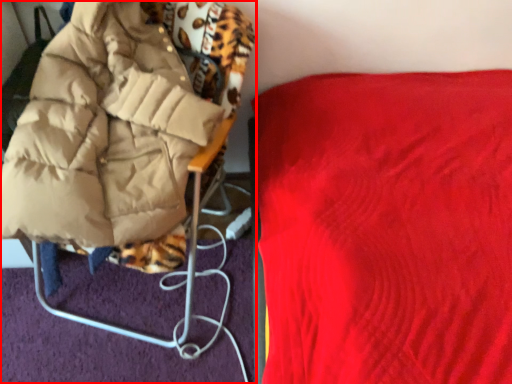
Question: In this image, where is furniture (annotated by the red box) located relative to furniture?

Choices:
 (A) left
 (B) right

Answer: (A)